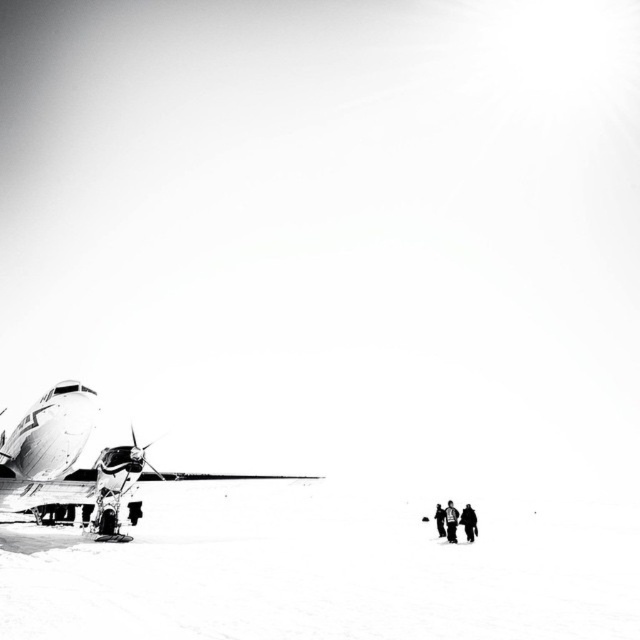
Question: Is metallic airplane at left behind dark gray jacket at lower right?

Choices:
 (A) no
 (B) yes

Answer: (A)

Question: Which point is farther to the camera?

Choices:
 (A) (456, 524)
 (B) (8, 444)

Answer: (A)

Question: Which is farther from the black fabric jacket at lower right?

Choices:
 (A) snowboarder at lower right
 (B) metallic airplane at left
 (C) dark gray jacket at lower right

Answer: (B)

Question: Which point is closer to the camera?

Choices:
 (A) metallic airplane at left
 (B) snowboarder at lower right

Answer: (A)

Question: From the image, what is the correct spatial relationship of snowboarder at lower right in relation to black fabric jacket at lower right?

Choices:
 (A) right
 (B) left

Answer: (B)

Question: In this image, where is metallic airplane at left located relative to snowboarder at lower right?

Choices:
 (A) below
 (B) above

Answer: (A)